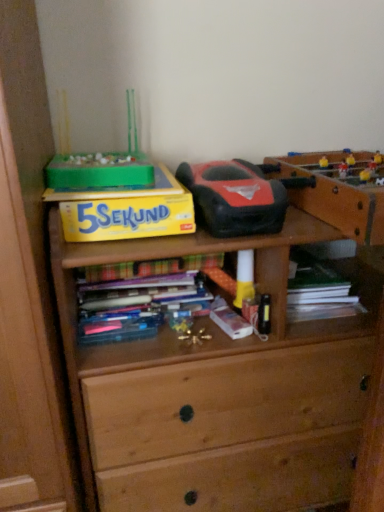
Locate an element on the screen. Image resolution: width=384 pixels, height=512 pixels. yellow matte paper at upper left is located at coordinates (126, 211).

Describe the element at coordinates (193, 336) in the screenshot. This screenshot has width=384, height=512. I see `metallic gold toy at center, the 2th toy positioned from the top` at that location.

In order to face hardcover book at center, should I rotate leftwards or rightwards?

It's best to rotate left around 6.915 degrees.

This screenshot has width=384, height=512. Find the location of `hardcover book at center`. hardcover book at center is located at coordinates (149, 268).

Where is `wooden table at upper right`? The height and width of the screenshot is (512, 384). wooden table at upper right is located at coordinates (337, 191).

What do you see at coordinates (337, 191) in the screenshot? I see `wooden table at upper right` at bounding box center [337, 191].

The width and height of the screenshot is (384, 512). What do you see at coordinates (234, 198) in the screenshot?
I see `rubberized black and red toy car at center, which is the 2th toy in bottom-to-top order` at bounding box center [234, 198].

Locate an element on the screen. yellow matte paper at upper left is located at coordinates (126, 211).

Is hardcover book at center facing away from yellow matte paper at upper left?

No, hardcover book at center's orientation is not away from yellow matte paper at upper left.

From the image's perspective, which object appears higher, hardcover book at center or yellow matte paper at upper left?

yellow matte paper at upper left is shown above in the image.

Identify the location of book that appears on the right of yellow matte paper at upper left. (149, 268).

Is hardcover book at center bigger than yellow matte paper at upper left?

Incorrect, hardcover book at center is not larger than yellow matte paper at upper left.

Who is bigger, metallic gold toy at center, which is counted as the first toy, starting from the bottom, or hardcover book at center?

Bigger between the two is hardcover book at center.

From a real-world perspective, relative to hardcover book at center, is metallic gold toy at center, which is counted as the first toy, starting from the bottom, vertically above or below?

From a real-world perspective, metallic gold toy at center, which is counted as the first toy, starting from the bottom, is physically below hardcover book at center.

Can hardcover book at center be found inside metallic gold toy at center, the 2th toy positioned from the top?

That's incorrect, hardcover book at center is not inside metallic gold toy at center, the 2th toy positioned from the top.

Considering the relative sizes of metallic gold toy at center, which is counted as the first toy, starting from the bottom, and hardcover book at center in the image provided, is metallic gold toy at center, which is counted as the first toy, starting from the bottom, wider than hardcover book at center?

No, metallic gold toy at center, which is counted as the first toy, starting from the bottom, is not wider than hardcover book at center.

From the image's perspective, would you say yellow matte paper at upper left is shown under rubberized black and red toy car at center, which is the 2th toy in bottom-to-top order?

Yes, from the image's perspective, yellow matte paper at upper left is below rubberized black and red toy car at center, which is the 2th toy in bottom-to-top order.

Is yellow matte paper at upper left outside of rubberized black and red toy car at center, which is the 2th toy in bottom-to-top order?

yellow matte paper at upper left lies outside rubberized black and red toy car at center, which is the 2th toy in bottom-to-top order,'s area.

Which of these two, yellow matte paper at upper left or rubberized black and red toy car at center, placed as the 1th toy when sorted from top to bottom, stands taller?

rubberized black and red toy car at center, placed as the 1th toy when sorted from top to bottom, is taller.

Are hardcover book at center and rubberized black and red toy car at center, placed as the 1th toy when sorted from top to bottom, beside each other?

They are not placed beside each other.

From the image's perspective, which one is positioned lower, hardcover book at center or rubberized black and red toy car at center, placed as the 1th toy when sorted from top to bottom?

hardcover book at center appears lower in the image.

Considering the relative sizes of hardcover book at center and rubberized black and red toy car at center, which is the 2th toy in bottom-to-top order, in the image provided, is hardcover book at center taller than rubberized black and red toy car at center, which is the 2th toy in bottom-to-top order,?

Incorrect, the height of hardcover book at center is not larger of that of rubberized black and red toy car at center, which is the 2th toy in bottom-to-top order.

In the image, is hardcover book at center on the left side or the right side of rubberized black and red toy car at center, which is the 2th toy in bottom-to-top order?

Clearly, hardcover book at center is on the left of rubberized black and red toy car at center, which is the 2th toy in bottom-to-top order, in the image.

Considering the relative sizes of metallic gold toy at center, which is counted as the first toy, starting from the bottom, and wooden table at upper right in the image provided, is metallic gold toy at center, which is counted as the first toy, starting from the bottom, bigger than wooden table at upper right?

Incorrect, metallic gold toy at center, which is counted as the first toy, starting from the bottom, is not larger than wooden table at upper right.

The height and width of the screenshot is (512, 384). Find the location of `cabinetry in front of the metallic gold toy at center, the 2th toy positioned from the top`. cabinetry in front of the metallic gold toy at center, the 2th toy positioned from the top is located at coordinates (337, 191).

Considering the sizes of metallic gold toy at center, the 2th toy positioned from the top, and wooden table at upper right in the image, is metallic gold toy at center, the 2th toy positioned from the top, taller or shorter than wooden table at upper right?

metallic gold toy at center, the 2th toy positioned from the top, is shorter than wooden table at upper right.

Can you see metallic gold toy at center, the 2th toy positioned from the top, touching wooden table at upper right?

No, metallic gold toy at center, the 2th toy positioned from the top, is not touching wooden table at upper right.

Is rubberized black and red toy car at center, which is the 2th toy in bottom-to-top order, aimed at metallic gold toy at center, the 2th toy positioned from the top?

No, rubberized black and red toy car at center, which is the 2th toy in bottom-to-top order, does not turn towards metallic gold toy at center, the 2th toy positioned from the top.

From a real-world perspective, is rubberized black and red toy car at center, which is the 2th toy in bottom-to-top order, located beneath metallic gold toy at center, which is counted as the first toy, starting from the bottom?

Incorrect, from a real-world perspective, rubberized black and red toy car at center, which is the 2th toy in bottom-to-top order, is higher than metallic gold toy at center, which is counted as the first toy, starting from the bottom.

Measure the distance between rubberized black and red toy car at center, placed as the 1th toy when sorted from top to bottom, and metallic gold toy at center, the 2th toy positioned from the top.

rubberized black and red toy car at center, placed as the 1th toy when sorted from top to bottom, is 12.49 inches away from metallic gold toy at center, the 2th toy positioned from the top.

Considering the sizes of objects rubberized black and red toy car at center, placed as the 1th toy when sorted from top to bottom, and metallic gold toy at center, the 2th toy positioned from the top, in the image provided, who is taller, rubberized black and red toy car at center, placed as the 1th toy when sorted from top to bottom, or metallic gold toy at center, the 2th toy positioned from the top,?

With more height is rubberized black and red toy car at center, placed as the 1th toy when sorted from top to bottom.

You are a GUI agent. You are given a task and a screenshot of the screen. Output one action in this format:
    pyautogui.click(x=<x>, y=<y>)
    Task: Click on the toy that appears below the rubberized black and red toy car at center, placed as the 1th toy when sorted from top to bottom (from a real-world perspective)
    This screenshot has height=512, width=384.
    Given the screenshot: What is the action you would take?
    pyautogui.click(x=193, y=336)

Visually, is metallic gold toy at center, which is counted as the first toy, starting from the bottom, positioned to the left or to the right of rubberized black and red toy car at center, which is the 2th toy in bottom-to-top order?

metallic gold toy at center, which is counted as the first toy, starting from the bottom, is to the left of rubberized black and red toy car at center, which is the 2th toy in bottom-to-top order.

Is point (203, 331) behind point (236, 198)?

That is True.

From a real-world perspective, is metallic gold toy at center, which is counted as the first toy, starting from the bottom, located higher than rubberized black and red toy car at center, placed as the 1th toy when sorted from top to bottom?

No, from a real-world perspective, metallic gold toy at center, which is counted as the first toy, starting from the bottom, is not above rubberized black and red toy car at center, placed as the 1th toy when sorted from top to bottom.

Identify the location of paperback book in front of the hardcover book at center. (126, 211).

Image resolution: width=384 pixels, height=512 pixels. Identify the location of book behind the metallic gold toy at center, which is counted as the first toy, starting from the bottom. (149, 268).

Looking at the image, which one is located further to hardcover book at center, metallic gold toy at center, the 2th toy positioned from the top, or rubberized black and red toy car at center, placed as the 1th toy when sorted from top to bottom?

rubberized black and red toy car at center, placed as the 1th toy when sorted from top to bottom, is further to hardcover book at center.

When comparing their distances from rubberized black and red toy car at center, placed as the 1th toy when sorted from top to bottom, does hardcover book at center or wooden table at upper right seem closer?

Based on the image, wooden table at upper right appears to be nearer to rubberized black and red toy car at center, placed as the 1th toy when sorted from top to bottom.

Which object lies nearer to the anchor point rubberized black and red toy car at center, placed as the 1th toy when sorted from top to bottom, hardcover book at center or yellow matte paper at upper left?

yellow matte paper at upper left.

Based on their spatial positions, is yellow matte paper at upper left or wooden table at upper right closer to hardcover book at center?

yellow matte paper at upper left is closer to hardcover book at center.

Which object lies nearer to the anchor point rubberized black and red toy car at center, placed as the 1th toy when sorted from top to bottom, metallic gold toy at center, which is counted as the first toy, starting from the bottom, or wooden table at upper right?

wooden table at upper right lies closer to rubberized black and red toy car at center, placed as the 1th toy when sorted from top to bottom, than the other object.

Which object lies nearer to the anchor point wooden table at upper right, metallic gold toy at center, the 2th toy positioned from the top, or rubberized black and red toy car at center, placed as the 1th toy when sorted from top to bottom?

rubberized black and red toy car at center, placed as the 1th toy when sorted from top to bottom, is closer to wooden table at upper right.

Looking at the image, which one is located closer to yellow matte paper at upper left, hardcover book at center or rubberized black and red toy car at center, which is the 2th toy in bottom-to-top order?

rubberized black and red toy car at center, which is the 2th toy in bottom-to-top order, is closer to yellow matte paper at upper left.

Based on their spatial positions, is yellow matte paper at upper left or metallic gold toy at center, which is counted as the first toy, starting from the bottom, further from wooden table at upper right?

The object further to wooden table at upper right is metallic gold toy at center, which is counted as the first toy, starting from the bottom.

Where is `book that lies between yellow matte paper at upper left and metallic gold toy at center, which is counted as the first toy, starting from the bottom, from top to bottom`? The height and width of the screenshot is (512, 384). book that lies between yellow matte paper at upper left and metallic gold toy at center, which is counted as the first toy, starting from the bottom, from top to bottom is located at coordinates (149, 268).

Where is `book located between yellow matte paper at upper left and rubberized black and red toy car at center, placed as the 1th toy when sorted from top to bottom, in the left-right direction`? book located between yellow matte paper at upper left and rubberized black and red toy car at center, placed as the 1th toy when sorted from top to bottom, in the left-right direction is located at coordinates (149, 268).

Where is `paperback book between rubberized black and red toy car at center, which is the 2th toy in bottom-to-top order, and metallic gold toy at center, the 2th toy positioned from the top, vertically`? paperback book between rubberized black and red toy car at center, which is the 2th toy in bottom-to-top order, and metallic gold toy at center, the 2th toy positioned from the top, vertically is located at coordinates (126, 211).

Identify the location of book between rubberized black and red toy car at center, which is the 2th toy in bottom-to-top order, and metallic gold toy at center, which is counted as the first toy, starting from the bottom, in the up-down direction. Image resolution: width=384 pixels, height=512 pixels. (149, 268).